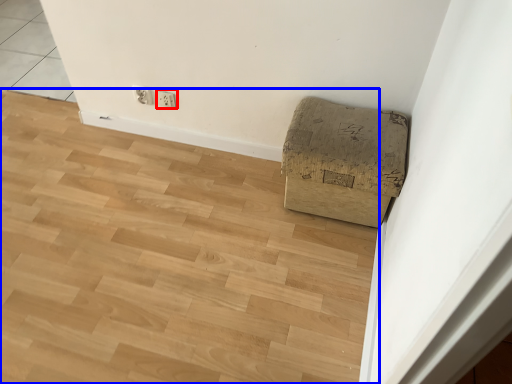
Question: Which point is further to the camera, electric outlet (highlighted by a red box) or plywood (highlighted by a blue box)?

Choices:
 (A) electric outlet
 (B) plywood

Answer: (A)